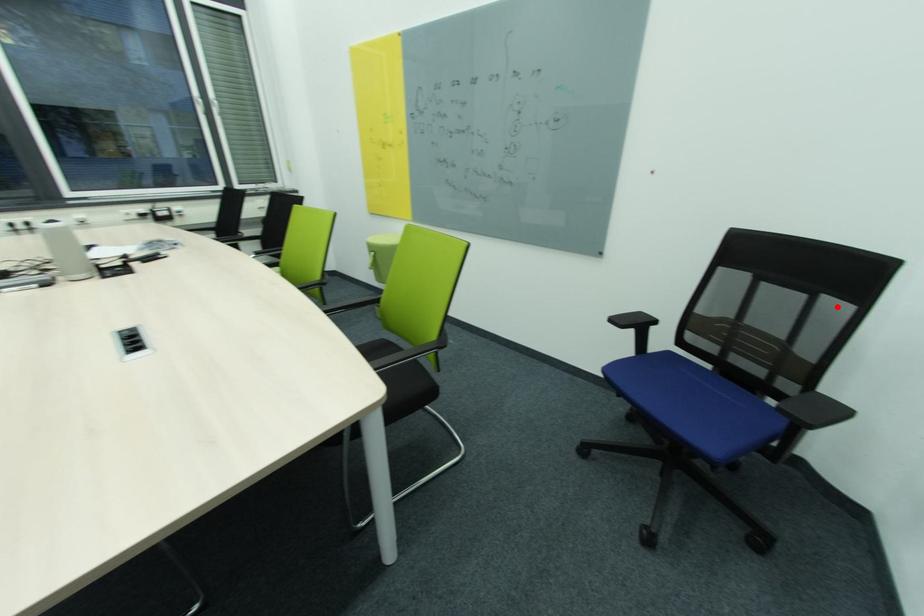
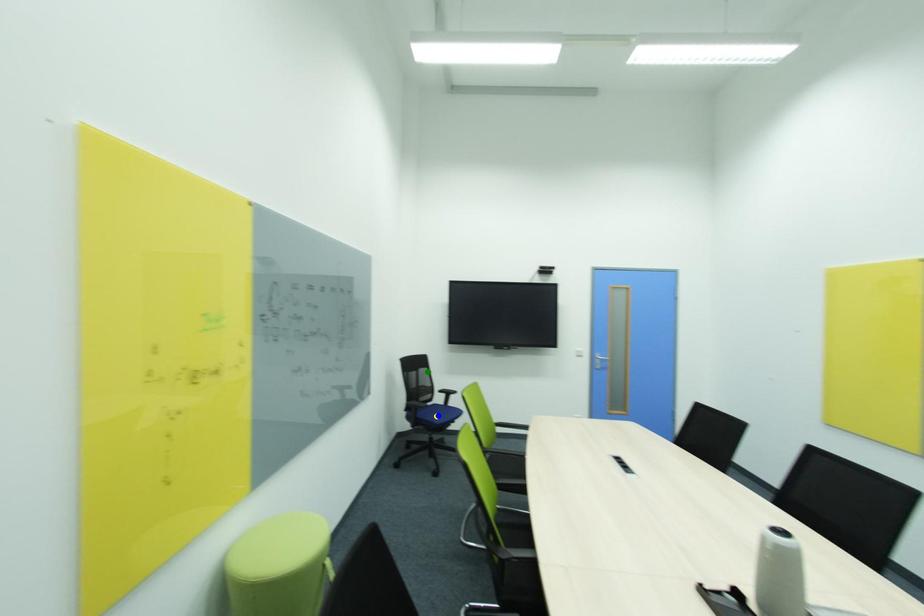
Question: I am providing you with two images of the same scene from different viewpoints. A red point is marked on the first image. You are given multiple points on the second image. Which point in image 2 represents the same 3d spot as the red point in image 1?

Choices:
 (A) yellow point
 (B) blue point
 (C) green point

Answer: (C)